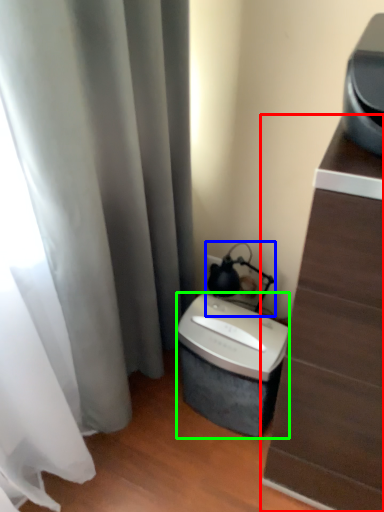
Question: Based on their relative distances, which object is farther from furniture (highlighted by a red box)? Choose from table lamp (highlighted by a blue box) and appliance (highlighted by a green box).

Choices:
 (A) table lamp
 (B) appliance

Answer: (A)